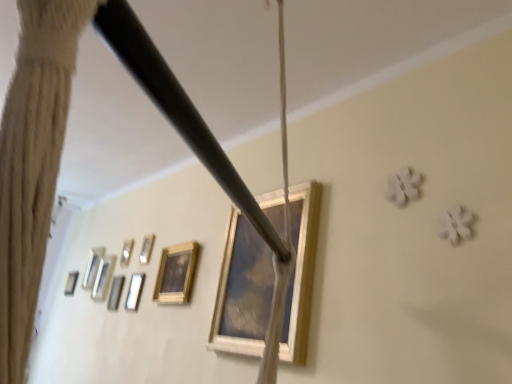
Question: Is metallic silver picture frame at upper left, which appears as the 2th picture frame when viewed from the back, with metallic silver picture frame at upper left, which appears as the fifth picture frame when viewed from the back?

Choices:
 (A) no
 (B) yes

Answer: (A)

Question: Would you consider metallic silver picture frame at upper left, which is counted as the 6th picture frame, starting from the front, to be distant from metallic silver picture frame at upper left, the fourth picture frame from the right?

Choices:
 (A) no
 (B) yes

Answer: (A)

Question: Can you confirm if metallic silver picture frame at upper left, which is counted as the second picture frame, starting from the left, is positioned to the left of metallic silver picture frame at upper left, marked as the 4th picture frame in a left-to-right arrangement?

Choices:
 (A) no
 (B) yes

Answer: (B)

Question: Considering the relative sizes of metallic silver picture frame at upper left, which appears as the 2th picture frame when viewed from the back, and metallic silver picture frame at upper left, which appears as the fifth picture frame when viewed from the back, in the image provided, is metallic silver picture frame at upper left, which appears as the 2th picture frame when viewed from the back, shorter than metallic silver picture frame at upper left, which appears as the fifth picture frame when viewed from the back,?

Choices:
 (A) yes
 (B) no

Answer: (B)

Question: From the image's perspective, is metallic silver picture frame at upper left, which appears as the 2th picture frame when viewed from the back, on top of metallic silver picture frame at upper left, the fourth picture frame from the right?

Choices:
 (A) yes
 (B) no

Answer: (A)

Question: Considering the relative positions of wooden picture frame at lower left, which appears as the 2th picture frame when viewed from the front, and metallic silver picture frame at upper left, the fourth picture frame positioned from the front, in the image provided, is wooden picture frame at lower left, which appears as the 2th picture frame when viewed from the front, to the left or to the right of metallic silver picture frame at upper left, the fourth picture frame positioned from the front,?

Choices:
 (A) right
 (B) left

Answer: (A)

Question: From their relative heights in the image, would you say wooden picture frame at lower left, which is counted as the 6th picture frame, starting from the left, is taller or shorter than metallic silver picture frame at upper left, placed as the 5th picture frame when sorted from left to right?

Choices:
 (A) tall
 (B) short

Answer: (A)

Question: From a real-world perspective, is wooden picture frame at lower left, which is counted as the 6th picture frame, starting from the left, positioned above or below metallic silver picture frame at upper left, which is the third picture frame from right to left?

Choices:
 (A) above
 (B) below

Answer: (B)

Question: Relative to metallic silver picture frame at upper left, placed as the 5th picture frame when sorted from left to right, is wooden picture frame at lower left, which is counted as the 6th picture frame, starting from the left, in front or behind?

Choices:
 (A) front
 (B) behind

Answer: (A)

Question: From their relative heights in the image, would you say wooden picture frame at center, the seventh picture frame when ordered from back to front, is taller or shorter than wooden picture frame at lower left, which is the second picture frame in right-to-left order?

Choices:
 (A) short
 (B) tall

Answer: (B)

Question: Does point click(301, 281) appear closer or farther from the camera than point click(166, 253)?

Choices:
 (A) farther
 (B) closer

Answer: (B)

Question: Considering the positions of wooden picture frame at center, which is counted as the first picture frame, starting from the front, and wooden picture frame at lower left, which is the second picture frame in right-to-left order, in the image, is wooden picture frame at center, which is counted as the first picture frame, starting from the front, wider or thinner than wooden picture frame at lower left, which is the second picture frame in right-to-left order,?

Choices:
 (A) thin
 (B) wide

Answer: (B)

Question: Looking at the image, does wooden picture frame at center, the seventh picture frame when ordered from back to front, seem bigger or smaller compared to wooden picture frame at lower left, which is the second picture frame in right-to-left order?

Choices:
 (A) big
 (B) small

Answer: (A)

Question: In terms of width, does metallic silver picture frame at upper left, placed as the 4th picture frame when sorted from back to front, look wider or thinner when compared to wooden picture frame at center, the seventh picture frame when ordered from back to front?

Choices:
 (A) wide
 (B) thin

Answer: (B)

Question: Is metallic silver picture frame at upper left, placed as the 5th picture frame when sorted from left to right, in front of or behind wooden picture frame at center, the seventh picture frame when ordered from back to front, in the image?

Choices:
 (A) behind
 (B) front

Answer: (A)